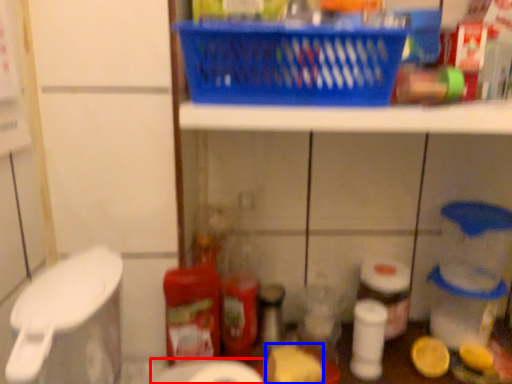
Question: Which of the following is the farthest to the observer, toilet paper (highlighted by a red box) or food (highlighted by a blue box)?

Choices:
 (A) toilet paper
 (B) food

Answer: (B)